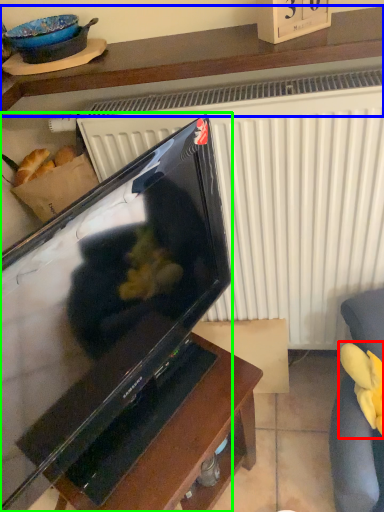
Question: Which object is the farthest from food (highlighted by a red box)? Choose among these: furniture (highlighted by a blue box) or television (highlighted by a green box).

Choices:
 (A) furniture
 (B) television

Answer: (A)